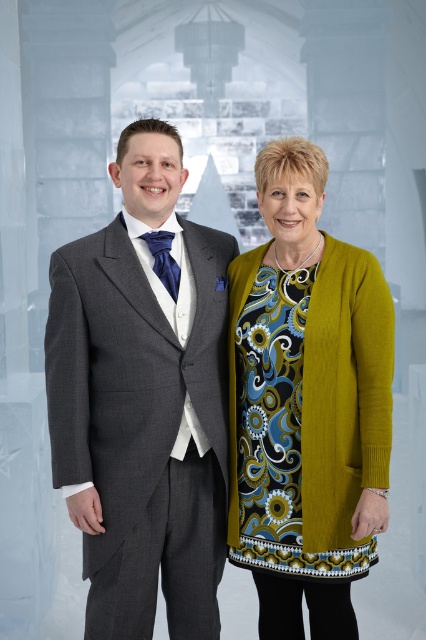
Question: Considering the relative positions of charcoal gray suit at left and green textured cardigan at right in the image provided, where is charcoal gray suit at left located with respect to green textured cardigan at right?

Choices:
 (A) above
 (B) below

Answer: (A)

Question: Considering the relative positions of charcoal gray suit at left and green textured cardigan at right in the image provided, where is charcoal gray suit at left located with respect to green textured cardigan at right?

Choices:
 (A) above
 (B) below

Answer: (A)

Question: Among these objects, which one is nearest to the camera?

Choices:
 (A) charcoal gray suit at left
 (B) green textured cardigan at right

Answer: (B)

Question: Is charcoal gray suit at left further to camera compared to green textured cardigan at right?

Choices:
 (A) yes
 (B) no

Answer: (A)